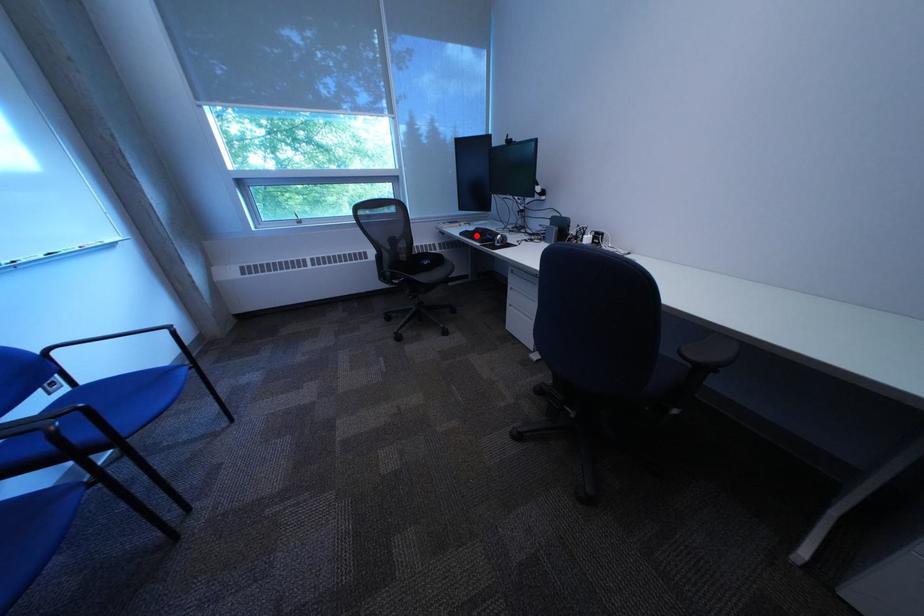
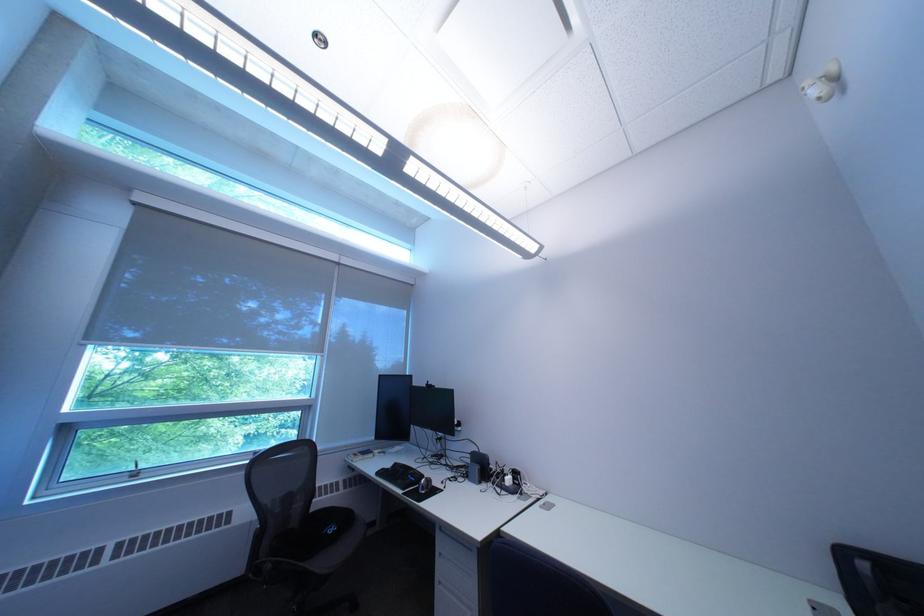
Question: I am providing you with two images of the same scene from different viewpoints. In image1, a red point is highlighted. Considering the same 3D point in image2, which of the following is correct?

Choices:
 (A) It is closer
 (B) It is farther

Answer: (B)